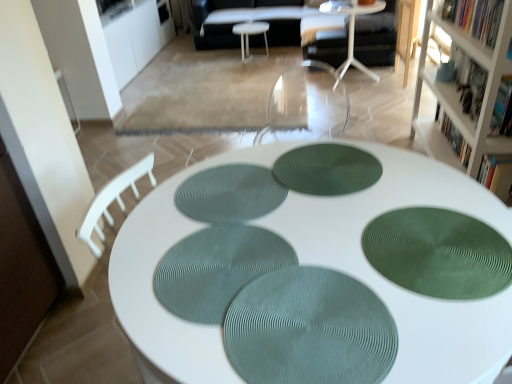
Identify the location of empty space that is to the right of green textured placemat at center, marked as the 3th mat in a left-to-right arrangement. This screenshot has width=512, height=384. pos(422,179).